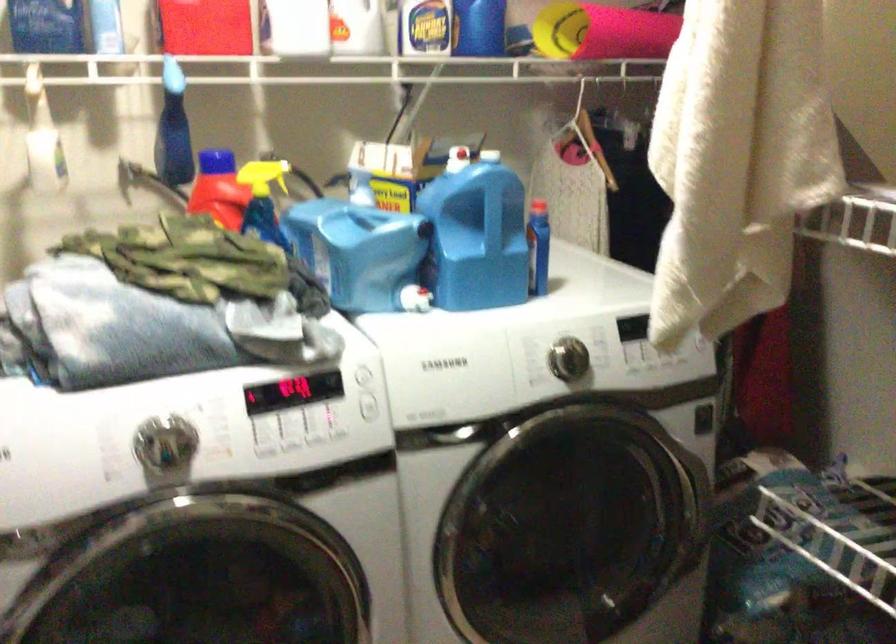
I want to click on red spray bottle trigger, so click(217, 160).